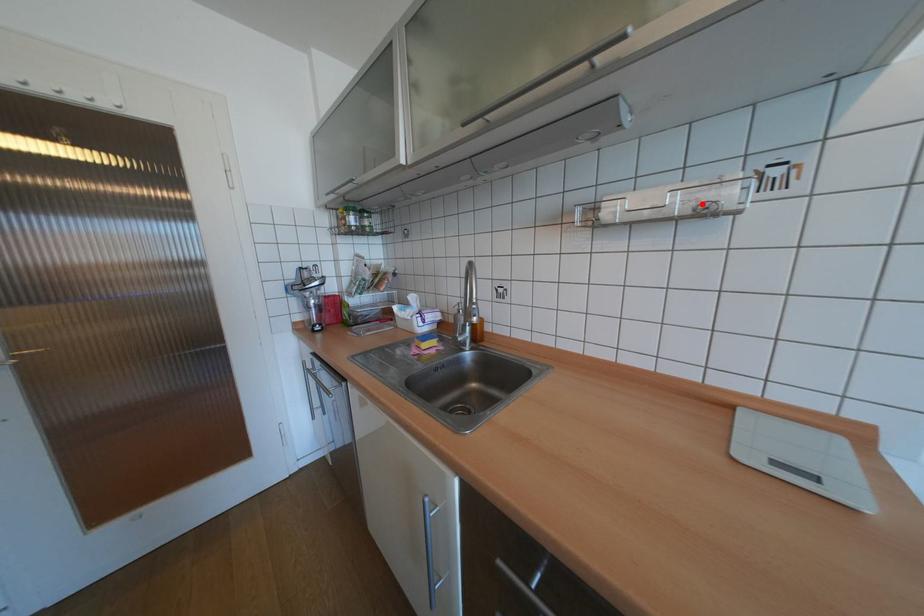
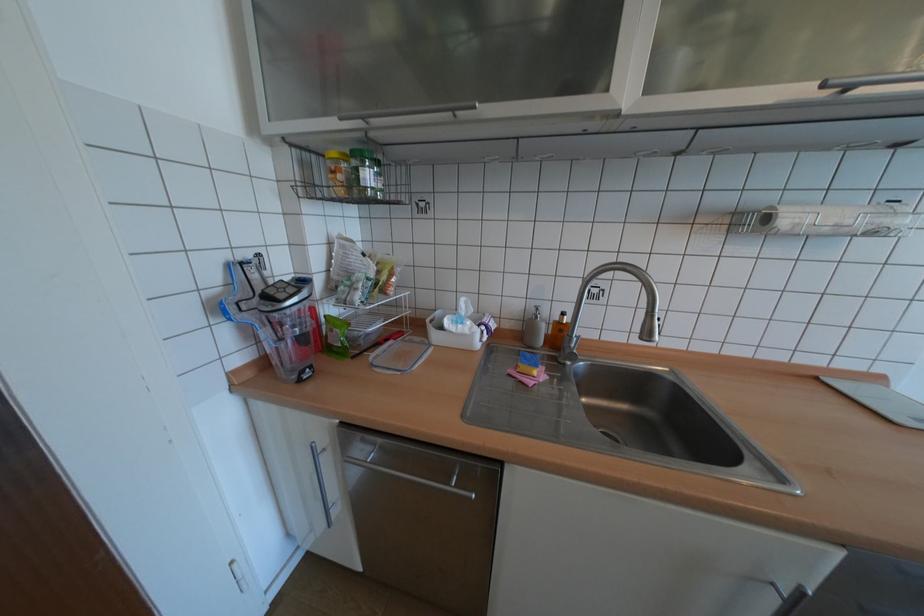
Where in the second image is the point corresponding to the highlighted location from the first image?

(881, 227)